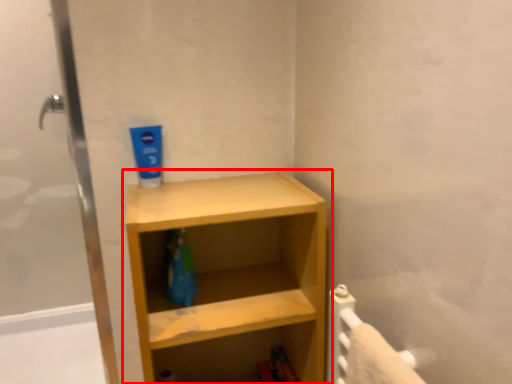
Question: From the image's perspective, considering the relative positions of shelf (annotated by the red box) and toothpaste in the image provided, where is shelf (annotated by the red box) located with respect to the staircase?

Choices:
 (A) above
 (B) below

Answer: (B)